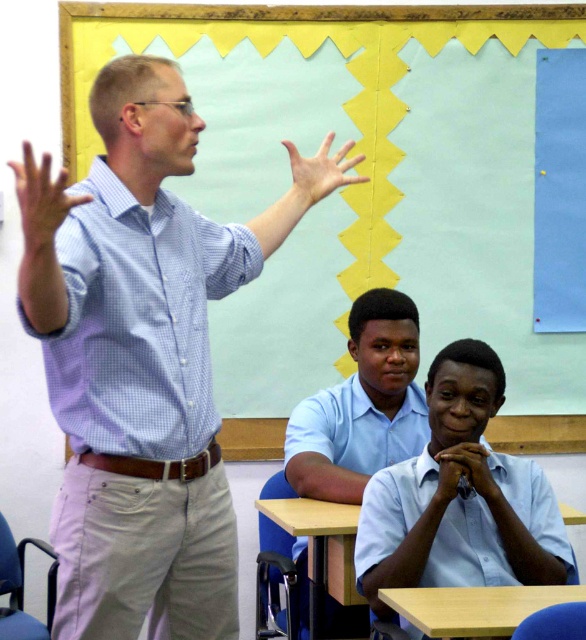
You are a student in the classroom and want to raise your hand to answer the teacher. The teacher is wearing the blue checkered shirt at upper left and you are sitting near the matte blue shirt at center. Can you see the teacher clearly from your position?

The blue checkered shirt at upper left is located above the matte blue shirt at center, so yes, you can see the teacher clearly from your position because the teacher is positioned higher up and not obstructed by the student in front.

You are a student in the classroom and need to locate the yellow textured paper at upper center. According to the scene description, where exactly is the yellow textured paper positioned relative to the teacher and the students?

The yellow textured paper at upper center is located at point coordinates (381, 189). This places it above and slightly to the left of the teacher and students, near the upper part of the classroom image.